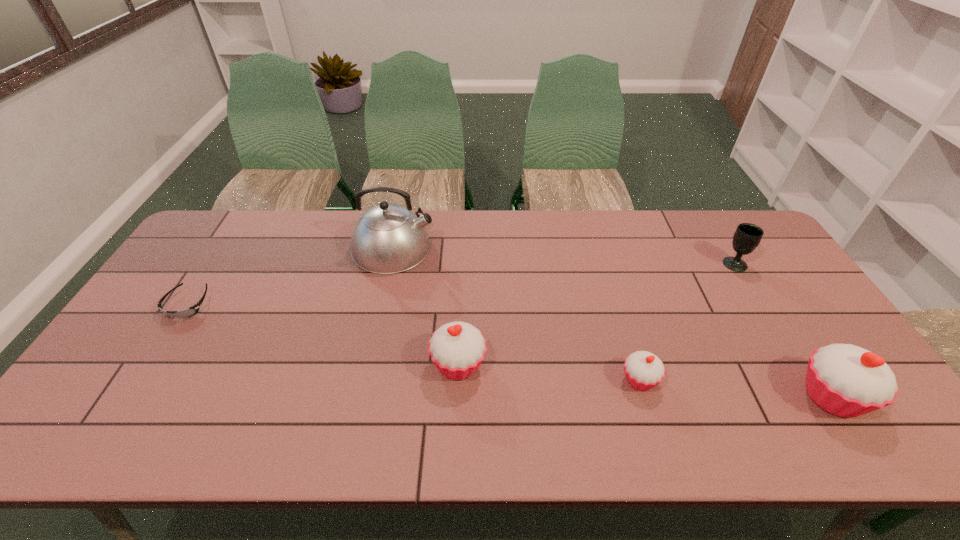
I want to click on cupcake that stands as the second closest to the third object from left to right, so click(x=846, y=380).

The width and height of the screenshot is (960, 540). I want to click on vacant point that satisfies the following two spatial constraints: 1. on the front side of the chalice; 2. on the right side of the rightmost cupcake, so click(x=816, y=396).

At what (x,y) coordinates should I click in order to perform the action: click on vacant position in the image that satisfies the following two spatial constraints: 1. from the spout of the tallest object; 2. on the lenses of the shortest object. Please return your answer as a coordinate pair (x, y). Looking at the image, I should click on (381, 305).

The height and width of the screenshot is (540, 960). In order to click on vacant position in the image that satisfies the following two spatial constraints: 1. on the lenses of the third farthest object; 2. on the left side of the shortest cupcake in this screenshot , I will do `click(139, 380)`.

Identify the location of blank space that satisfies the following two spatial constraints: 1. on the front side of the chalice; 2. on the left side of the rightmost cupcake. (816, 396).

Find the location of a particular element. The height and width of the screenshot is (540, 960). free space that satisfies the following two spatial constraints: 1. on the front side of the rightmost cupcake; 2. on the left side of the chalice is located at coordinates (816, 396).

Where is `blank area in the image that satisfies the following two spatial constraints: 1. on the back side of the chalice; 2. on the right side of the fifth tallest object`? blank area in the image that satisfies the following two spatial constraints: 1. on the back side of the chalice; 2. on the right side of the fifth tallest object is located at coordinates (604, 264).

What are the coordinates of `free region that satisfies the following two spatial constraints: 1. from the spout of the rightmost cupcake; 2. on the right side of the kettle` in the screenshot? It's located at (361, 396).

This screenshot has height=540, width=960. Find the location of `free spot that satisfies the following two spatial constraints: 1. on the lenses of the leftmost object; 2. on the right side of the second shortest cupcake`. free spot that satisfies the following two spatial constraints: 1. on the lenses of the leftmost object; 2. on the right side of the second shortest cupcake is located at coordinates (149, 365).

Locate an element on the screen. free space that satisfies the following two spatial constraints: 1. on the lenses of the rightmost cupcake; 2. on the right side of the sunglasses is located at coordinates (129, 396).